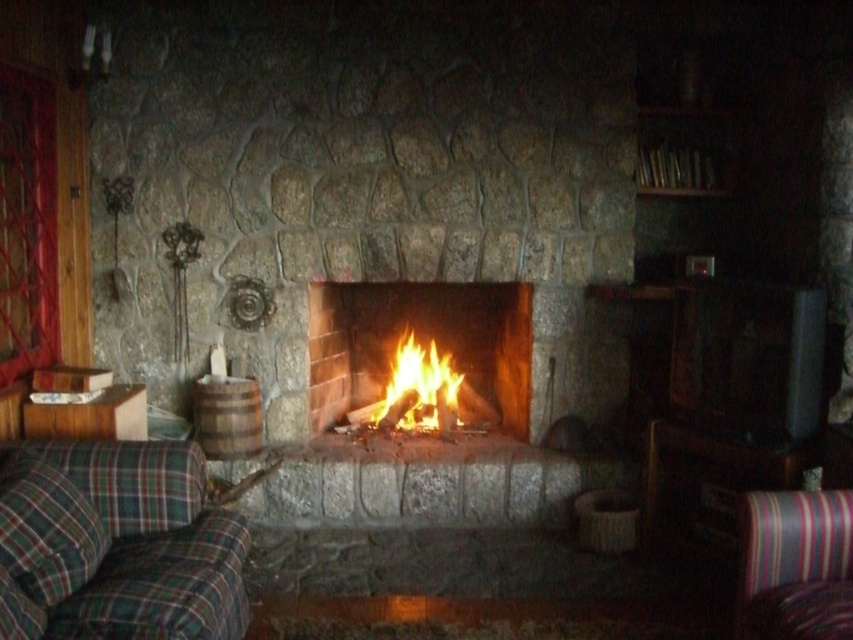
Which is in front, point (90, 493) or point (428, 426)?

Point (90, 493) is in front.

Who is shorter, green plaid fabric couch at lower left or flaming wood at center?

Standing shorter between the two is flaming wood at center.

Is point (129, 529) positioned before point (456, 378)?

Yes, point (129, 529) is closer to viewer.

Identify the location of green plaid fabric couch at lower left. (115, 545).

Is green plaid fabric couch at lower left closer to camera compared to striped fabric armchair at lower right?

Yes.

Does point (172, 451) come behind point (798, 577)?

Yes, it is behind point (798, 577).

Is point (61, 522) behind point (815, 612)?

That is True.

Locate an element on the screen. The image size is (853, 640). green plaid fabric couch at lower left is located at coordinates (115, 545).

Is point (0, 580) farther from viewer compared to point (469, 342)?

No, it is in front of (469, 342).

Consider the image. Is green plaid fabric couch at lower left further to camera compared to orange flame fire at center?

No, it is not.

Is point (238, 568) in front of point (466, 396)?

That is True.

The width and height of the screenshot is (853, 640). What are the coordinates of `green plaid fabric couch at lower left` in the screenshot? It's located at (115, 545).